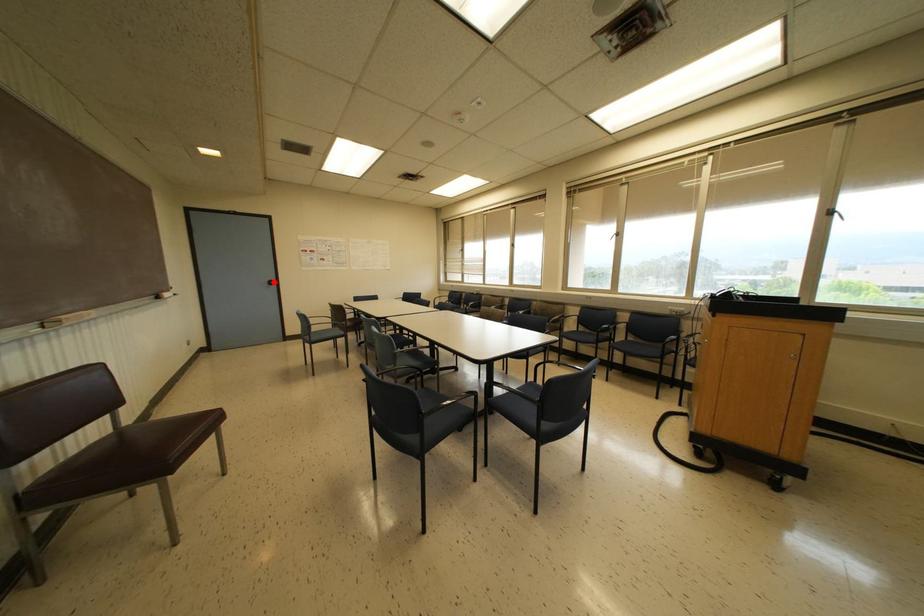
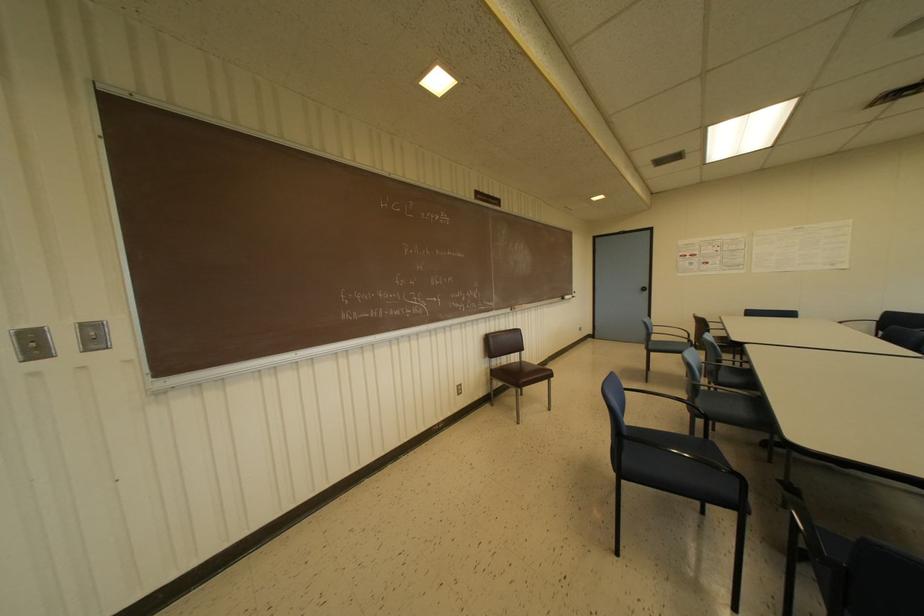
Question: A red point is marked in image1. In image2, is the corresponding 3D point closer to the camera or farther? Reply with the corresponding letter.

Choices:
 (A) The corresponding 3D point is closer.
 (B) The corresponding 3D point is farther.

Answer: (A)